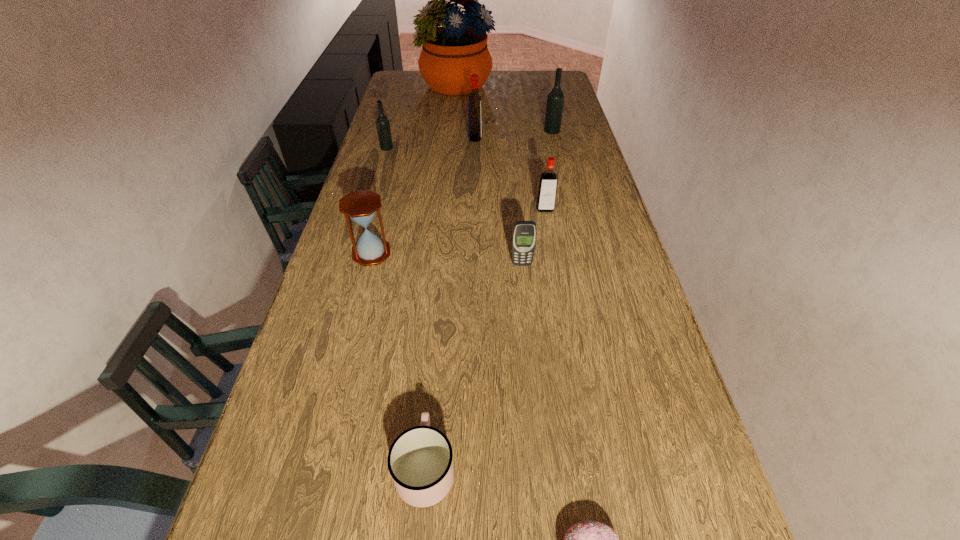
At what (x,y) coordinates should I click in order to perform the action: click on flower arrangement. Please return your answer as a coordinate pair (x, y). Image resolution: width=960 pixels, height=540 pixels. Looking at the image, I should click on (450, 54).

The width and height of the screenshot is (960, 540). Identify the location of the tallest object. (450, 54).

Locate an element on the screen. The width and height of the screenshot is (960, 540). the bigger red vodka is located at coordinates (474, 100).

Where is `the farther red vodka`? The height and width of the screenshot is (540, 960). the farther red vodka is located at coordinates (474, 100).

At what (x,y) coordinates should I click in order to perform the action: click on the bigger black vodka. Please return your answer as a coordinate pair (x, y). The height and width of the screenshot is (540, 960). Looking at the image, I should click on (555, 100).

You are a GUI agent. You are given a task and a screenshot of the screen. Output one action in this format:
    pyautogui.click(x=<x>, y=<y>)
    Task: Click on the rightmost object
    This screenshot has width=960, height=540.
    Given the screenshot: What is the action you would take?
    pyautogui.click(x=555, y=100)

I want to click on the sixth nearest object, so click(382, 122).

I want to click on the leftmost vodka, so click(382, 122).

Where is `the fifth nearest object`? the fifth nearest object is located at coordinates (547, 190).

You are a GUI agent. You are given a task and a screenshot of the screen. Output one action in this format:
    pyautogui.click(x=<x>, y=<y>)
    Task: Click on the nearer red vodka
    
    Given the screenshot: What is the action you would take?
    pyautogui.click(x=547, y=190)